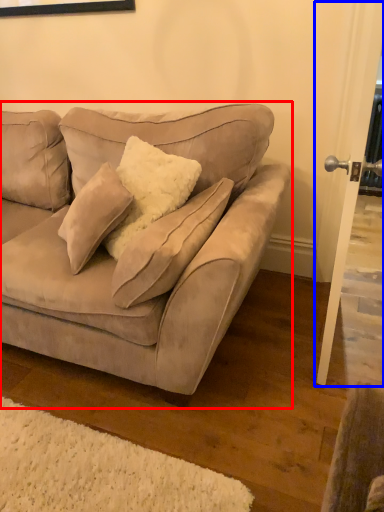
Question: Which of the following is the farthest to the observer, studio couch (highlighted by a red box) or screen door (highlighted by a blue box)?

Choices:
 (A) studio couch
 (B) screen door

Answer: (B)